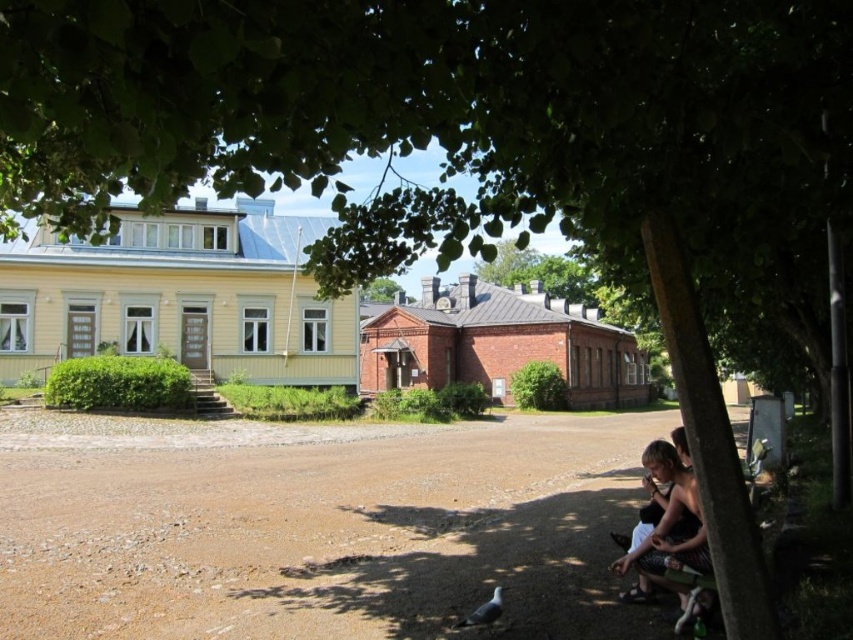
Question: Can you confirm if green leafy tree at upper center is wider than green leafy tree at center?

Choices:
 (A) no
 (B) yes

Answer: (B)

Question: Which point appears farthest from the camera in this image?

Choices:
 (A) (218, 108)
 (B) (380, 285)

Answer: (B)

Question: Among these objects, which one is farthest from the camera?

Choices:
 (A) green leafy tree at upper center
 (B) green leafy tree at center

Answer: (B)

Question: Is green leafy tree at upper center above green leafy tree at center?

Choices:
 (A) yes
 (B) no

Answer: (B)

Question: Which of the following is the farthest from the observer?

Choices:
 (A) (426, 209)
 (B) (392, 282)

Answer: (B)

Question: Does green leafy tree at upper center have a lesser width compared to green leafy tree at center?

Choices:
 (A) no
 (B) yes

Answer: (A)